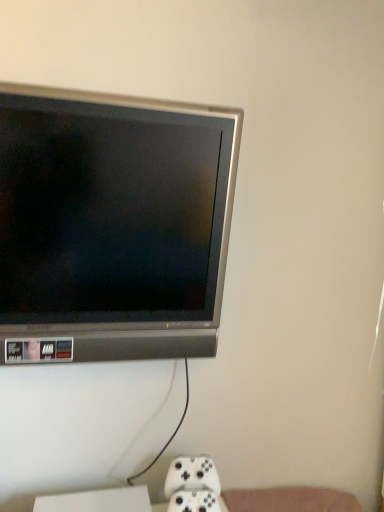
Question: Is white matte game controller at lower center to the left of satin silver television at upper left from the viewer's perspective?

Choices:
 (A) yes
 (B) no

Answer: (B)

Question: Can you confirm if white matte game controller at lower center is shorter than satin silver television at upper left?

Choices:
 (A) yes
 (B) no

Answer: (A)

Question: Is white matte game controller at lower center behind satin silver television at upper left?

Choices:
 (A) no
 (B) yes

Answer: (B)

Question: Are white matte game controller at lower center and satin silver television at upper left located far from each other?

Choices:
 (A) yes
 (B) no

Answer: (B)

Question: From a real-world perspective, is white matte game controller at lower center located beneath satin silver television at upper left?

Choices:
 (A) no
 (B) yes

Answer: (B)

Question: Is white matte game controller at lower center positioned in front of satin silver television at upper left?

Choices:
 (A) no
 (B) yes

Answer: (A)

Question: Can you confirm if satin silver television at upper left is bigger than white matte game controller at lower center?

Choices:
 (A) yes
 (B) no

Answer: (A)

Question: Does satin silver television at upper left have a lesser height compared to white matte game controller at lower center?

Choices:
 (A) yes
 (B) no

Answer: (B)

Question: From a real-world perspective, is satin silver television at upper left positioned under white matte game controller at lower center based on gravity?

Choices:
 (A) yes
 (B) no

Answer: (B)

Question: Considering the relative sizes of satin silver television at upper left and white matte game controller at lower center in the image provided, is satin silver television at upper left thinner than white matte game controller at lower center?

Choices:
 (A) yes
 (B) no

Answer: (B)

Question: Would you say satin silver television at upper left is outside white matte game controller at lower center?

Choices:
 (A) no
 (B) yes

Answer: (B)

Question: Is satin silver television at upper left directly adjacent to white matte game controller at lower center?

Choices:
 (A) yes
 (B) no

Answer: (B)

Question: From the image's perspective, is satin silver television at upper left located above or below white matte game controller at lower center?

Choices:
 (A) below
 (B) above

Answer: (B)